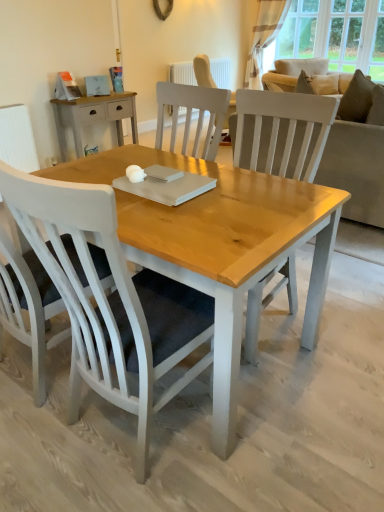
Where is `unoccupied region to the right of white painted wood chair at center, arranged as the 1th chair when viewed from the right`? The image size is (384, 512). unoccupied region to the right of white painted wood chair at center, arranged as the 1th chair when viewed from the right is located at coordinates (268, 430).